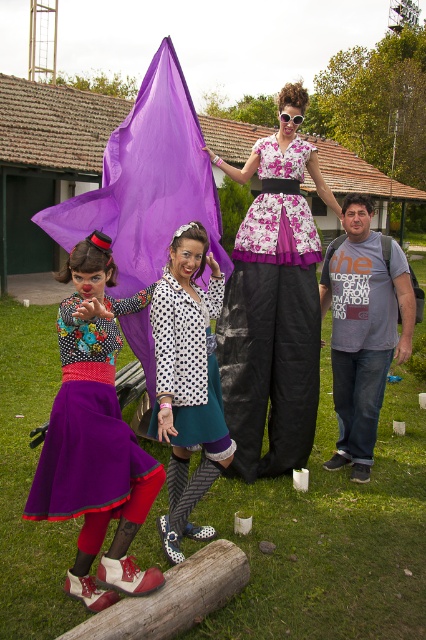
Which is in front, point (138, 579) or point (299, 118)?

Positioned in front is point (138, 579).

Can you confirm if matte purple skirt at lower left is smaller than clear plastic goggles at center?

No, matte purple skirt at lower left is not smaller than clear plastic goggles at center.

Between point (118, 499) and point (294, 124), which one is positioned behind?

The point (294, 124) is behind.

Where is `matte purple skirt at lower left`? matte purple skirt at lower left is located at coordinates (94, 435).

Does point (288, 243) come in front of point (327, 465)?

Yes, it is in front of point (327, 465).

Locate an element on the screen. The width and height of the screenshot is (426, 640). floral fabric dress at center is located at coordinates (273, 310).

Does gray cotton t-shirt at center have a greater height compared to clear plastic goggles at center?

Correct, gray cotton t-shirt at center is much taller as clear plastic goggles at center.

What are the coordinates of `gray cotton t-shirt at center` in the screenshot? It's located at (362, 330).

Between point (371, 272) and point (287, 118), which one is positioned in front?

Point (287, 118)

Where is `gray cotton t-shirt at center`? The image size is (426, 640). gray cotton t-shirt at center is located at coordinates (362, 330).